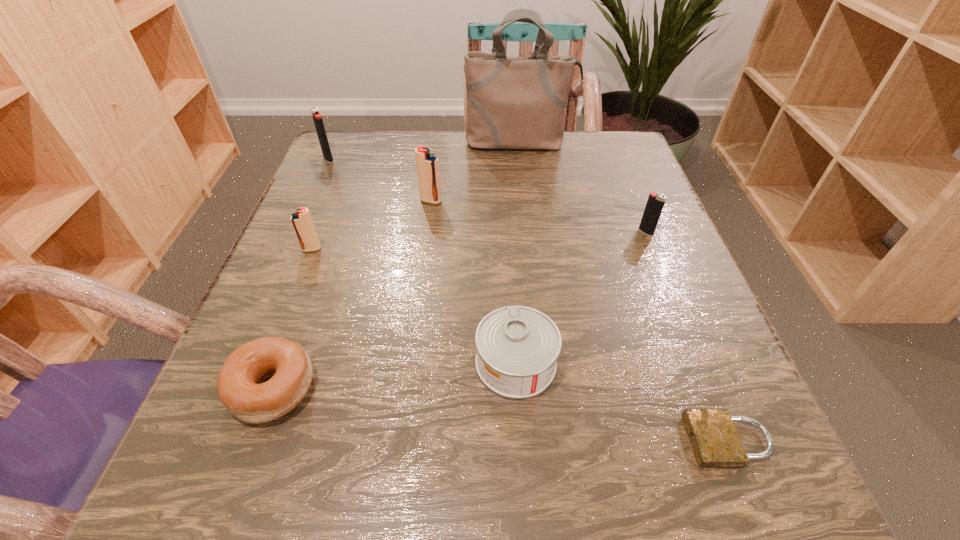
Identify the location of tan shoulder bag. (512, 102).

What are the coordinates of `shoulder bag` in the screenshot? It's located at (512, 102).

Locate an element on the screen. This screenshot has height=540, width=960. the bigger black igniter is located at coordinates (317, 118).

Where is `the farthest igniter`? The width and height of the screenshot is (960, 540). the farthest igniter is located at coordinates (317, 118).

Where is `the right red igniter`? Image resolution: width=960 pixels, height=540 pixels. the right red igniter is located at coordinates click(427, 163).

Where is `the bigger red igniter`? This screenshot has height=540, width=960. the bigger red igniter is located at coordinates (427, 163).

This screenshot has width=960, height=540. I want to click on the nearest igniter, so click(302, 222).

Locate an element on the screen. The width and height of the screenshot is (960, 540). the fourth nearest object is located at coordinates (302, 222).

Find the location of a particular element. Image resolution: width=960 pixels, height=540 pixels. the nearer black igniter is located at coordinates (655, 203).

This screenshot has width=960, height=540. Find the location of `the fourth farthest object`. the fourth farthest object is located at coordinates (655, 203).